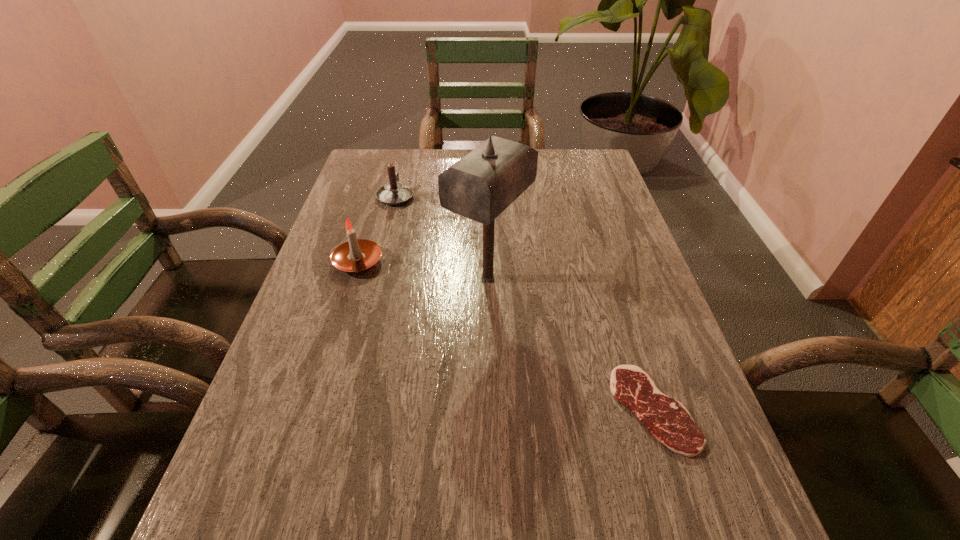
Where is `unoccupied position between the tallest object and the steak`? The height and width of the screenshot is (540, 960). unoccupied position between the tallest object and the steak is located at coordinates (571, 343).

Locate an element on the screen. The image size is (960, 540). object that is the second closest one to the second shortest object is located at coordinates (480, 186).

Identify which object is the third nearest to the farthest object. Please provide its 2D coordinates. Your answer should be formatted as a tuple, i.e. [(x, y)], where the tuple contains the x and y coordinates of a point satisfying the conditions above.

[(667, 419)]

You are a GUI agent. You are given a task and a screenshot of the screen. Output one action in this format:
    pyautogui.click(x=<x>, y=<y>)
    Task: Click on the free space that satisfies the following two spatial constraints: 1. on the front side of the taller candle; 2. on the right side of the tallest object
    This screenshot has height=540, width=960.
    Given the screenshot: What is the action you would take?
    pyautogui.click(x=353, y=278)

Identify the location of vacant space that satisfies the following two spatial constraints: 1. on the front side of the third shortest object; 2. on the left side of the mallet. Image resolution: width=960 pixels, height=540 pixels. (353, 278).